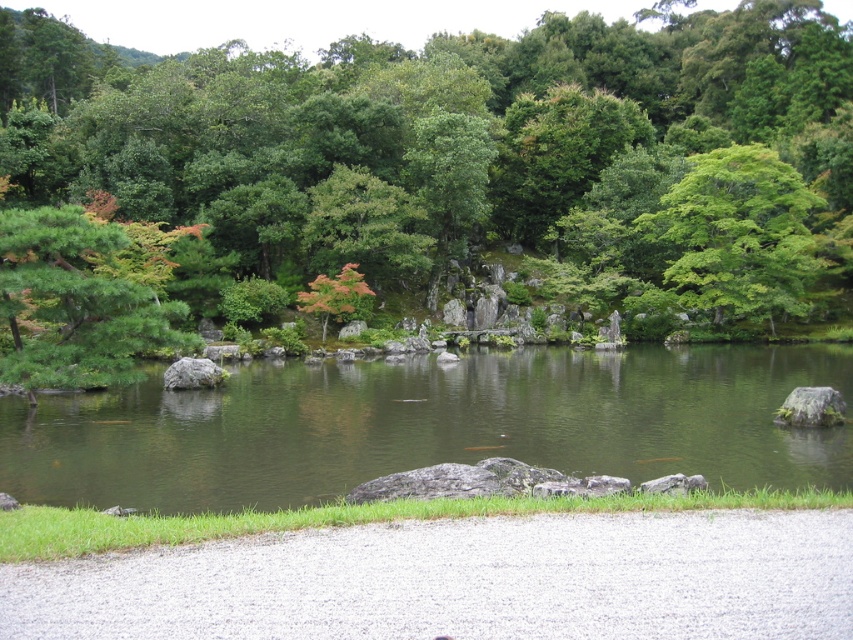
You are standing at the edge of the pond and want to walk to the orange matte tree at center. Which direction should you head towards from the green matte tree at left?

The green matte tree at left is to the left of the orange matte tree at center, so you should head towards the right to reach the orange matte tree at center from the green matte tree at left.

You are planning to plant a new tree in your backyard. You want to choose between the green matte tree at left and the orange matte tree at center based on their sizes. Which tree should you choose if you want a larger tree?

The green matte tree at left has a larger size compared to the orange matte tree at center, so you should choose the green matte tree at left if you want a larger tree.

You are standing at the edge of the pond and want to walk towards the orange matte tree at center. Which direction should you walk to avoid the green leafy tree at upper right?

Since the green leafy tree at upper right is to the right of the orange matte tree at center, you should walk to the left to avoid it.